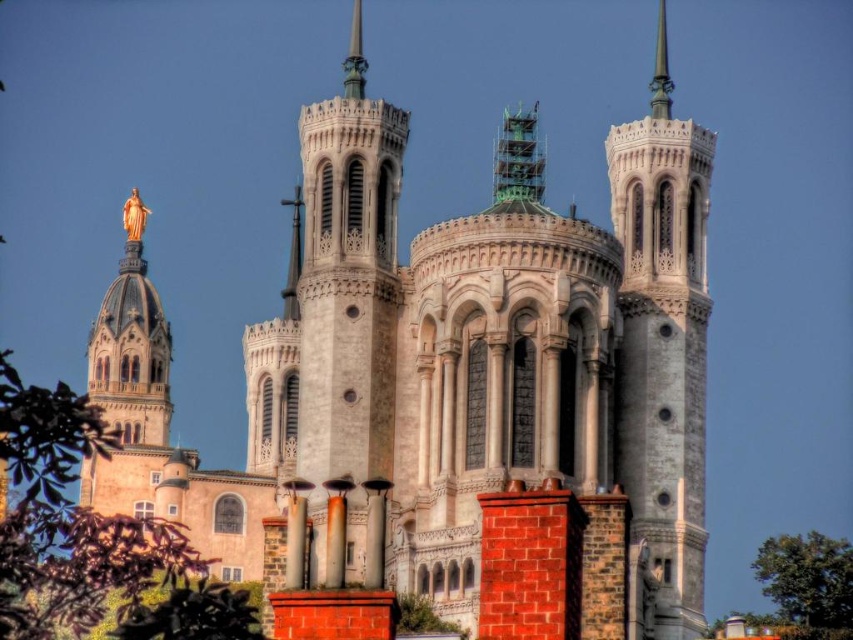
You are an architect analyzing the cathedral design. You notice the polished silver spire at upper right and the polished bronze spire at center. Which spire appears closer to you from your viewing position?

The polished bronze spire at center is behind the polished silver spire at upper right, so the polished silver spire at upper right appears closer to you.

You are a drone operator who needs to fly a drone from the red brick wall with chimneys to the green leafy tree at lower right. The drone has a maximum flight range of 100 meters. Can the drone reach the tree without needing to recharge?

The distance between the red brick wall with chimneys and the green leafy tree at lower right is 102.07 meters. Since the drone can only fly 100 meters before needing to recharge, it cannot reach the tree without recharging.

You are standing in front of the cathedral and want to know which of the two points, point (683, 228) or point (659, 100), is closer to you. Based on the scene, can you determine which one is nearer?

Point (683, 228) is closer to the viewer than point (659, 100).